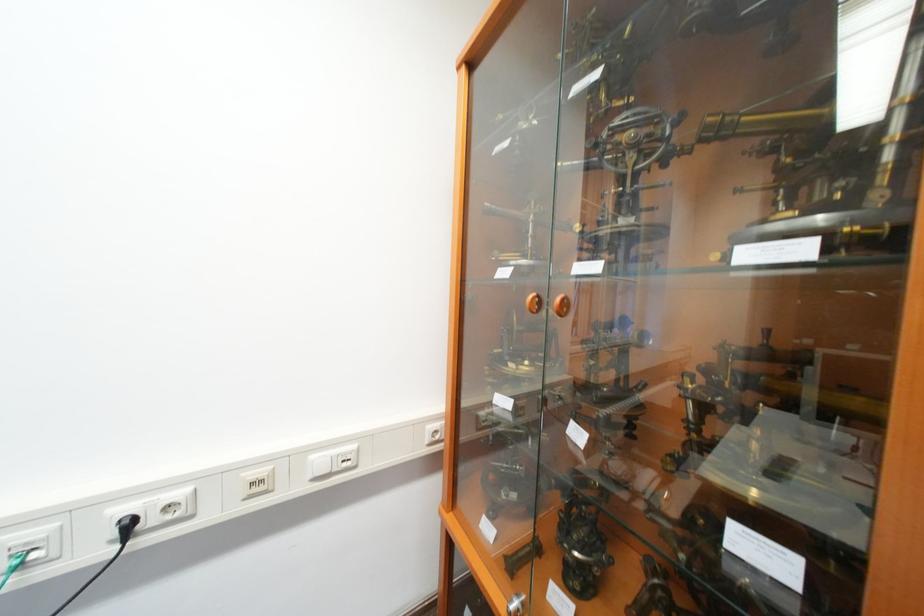
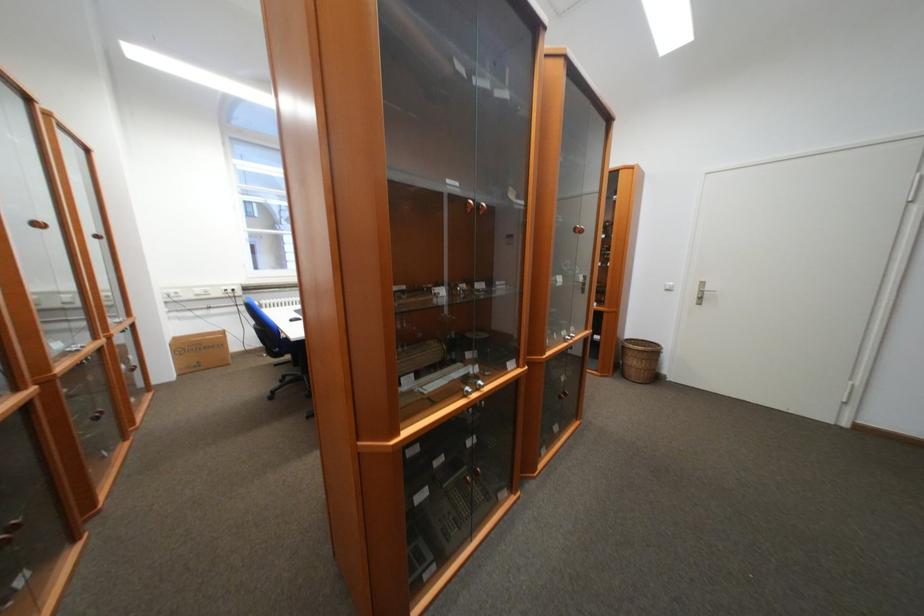
Question: I am providing you with two images of the same scene from different viewpoints. After the viewpoint changes to image2, which objects are now occluded?

Choices:
 (A) round wooden handle
 (B) white power socket
 (C) black book
 (D) wooden cabinet handle

Answer: (A)